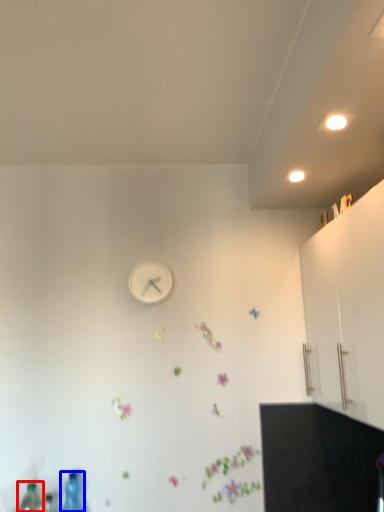
Question: Which point is closer to the camera, bottle (highlighted by a red box) or bottle (highlighted by a blue box)?

Choices:
 (A) bottle
 (B) bottle

Answer: (A)